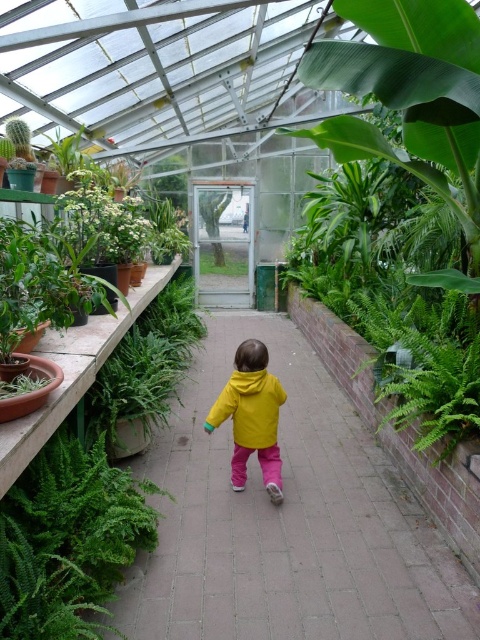
Question: Is yellow fabric at center positioned in front of yellow matte jacket at center?

Choices:
 (A) yes
 (B) no

Answer: (A)

Question: Which point is farther from the camera taking this photo?

Choices:
 (A) (271, 428)
 (B) (337, 410)

Answer: (B)

Question: Does yellow fabric at center lie in front of yellow matte jacket at center?

Choices:
 (A) no
 (B) yes

Answer: (B)

Question: Which point appears closest to the camera in this image?

Choices:
 (A) (269, 456)
 (B) (252, 573)

Answer: (B)

Question: Does yellow fabric at center appear under yellow matte jacket at center?

Choices:
 (A) yes
 (B) no

Answer: (A)